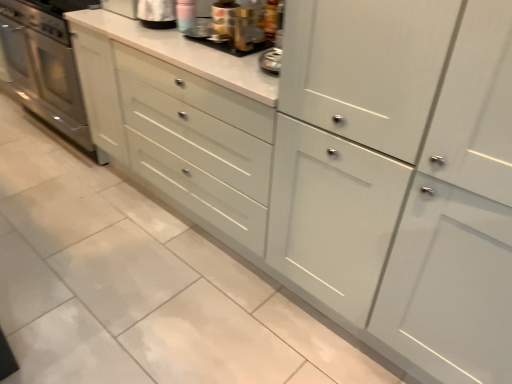
Describe the element at coordinates (244, 29) in the screenshot. The height and width of the screenshot is (384, 512). I see `metallic gold coffee pot at upper center, the 1th appliance when ordered from right to left` at that location.

The width and height of the screenshot is (512, 384). I want to click on metallic silver toaster at upper center, the 2th appliance viewed from the right, so click(231, 45).

Does stainless steel oven at left turn towards metallic gold coffee pot at upper center, the 1th appliance when ordered from right to left?

No, stainless steel oven at left is not facing towards metallic gold coffee pot at upper center, the 1th appliance when ordered from right to left.

Are stainless steel oven at left and metallic gold coffee pot at upper center, the 3th appliance positioned from the left, far apart?

Indeed, stainless steel oven at left is not near metallic gold coffee pot at upper center, the 3th appliance positioned from the left.

Could metallic gold coffee pot at upper center, the 3th appliance positioned from the left, be considered to be inside stainless steel oven at left?

No, metallic gold coffee pot at upper center, the 3th appliance positioned from the left, is located outside of stainless steel oven at left.

From the image's perspective, is stainless steel oven at left under metallic gold coffee pot at upper center, the 1th appliance when ordered from right to left?

Incorrect, from the image's perspective, stainless steel oven at left is higher than metallic gold coffee pot at upper center, the 1th appliance when ordered from right to left.

From the image's perspective, is metallic gold coffee pot at upper center, the 3th appliance positioned from the left, located above metallic silver toaster at upper center, which appears as the 2th appliance when viewed from the left?

No, from the image's perspective, metallic gold coffee pot at upper center, the 3th appliance positioned from the left, is not above metallic silver toaster at upper center, which appears as the 2th appliance when viewed from the left.

Does point (239, 40) appear closer or farther from the camera than point (268, 42)?

Clearly, point (239, 40) is closer to the camera than point (268, 42).

Are metallic gold coffee pot at upper center, the 3th appliance positioned from the left, and metallic silver toaster at upper center, which appears as the 2th appliance when viewed from the left, beside each other?

Indeed, metallic gold coffee pot at upper center, the 3th appliance positioned from the left, and metallic silver toaster at upper center, which appears as the 2th appliance when viewed from the left, are beside each other and touching.

Would you say metallic gold coffee pot at upper center, the 3th appliance positioned from the left, is outside metallic silver toaster at upper center, which appears as the 2th appliance when viewed from the left?

Indeed, metallic gold coffee pot at upper center, the 3th appliance positioned from the left, is completely outside metallic silver toaster at upper center, which appears as the 2th appliance when viewed from the left.

Can you confirm if stainless steel oven at left is smaller than metallic silver toaster at upper center, the 2th appliance viewed from the right?

Incorrect, stainless steel oven at left is not smaller in size than metallic silver toaster at upper center, the 2th appliance viewed from the right.

Visually, is stainless steel oven at left positioned to the left or to the right of metallic silver toaster at upper center, the 2th appliance viewed from the right?

Clearly, stainless steel oven at left is on the left of metallic silver toaster at upper center, the 2th appliance viewed from the right, in the image.

Is stainless steel oven at left far from metallic silver toaster at upper center, the 2th appliance viewed from the right?

Yes.

Is point (36, 46) closer or farther from the camera than point (259, 48)?

Point (36, 46) is farther from the camera than point (259, 48).

Between stainless steel oven at left and metallic silver toaster at upper center, positioned as the 1th appliance in left-to-right order, which one is positioned behind?

stainless steel oven at left is behind.

Would you say stainless steel oven at left is to the left or to the right of metallic silver toaster at upper center, positioned as the 1th appliance in left-to-right order, in the picture?

stainless steel oven at left is positioned on metallic silver toaster at upper center, positioned as the 1th appliance in left-to-right order,'s left side.

Does stainless steel oven at left turn towards metallic silver toaster at upper center, positioned as the 1th appliance in left-to-right order?

No, stainless steel oven at left is not turned towards metallic silver toaster at upper center, positioned as the 1th appliance in left-to-right order.

Which object is positioned more to the right, metallic silver toaster at upper center, the 2th appliance viewed from the right, or stainless steel oven at left?

Positioned to the right is metallic silver toaster at upper center, the 2th appliance viewed from the right.

Can you confirm if metallic silver toaster at upper center, which appears as the 2th appliance when viewed from the left, is wider than stainless steel oven at left?

Incorrect, the width of metallic silver toaster at upper center, which appears as the 2th appliance when viewed from the left, does not surpass that of stainless steel oven at left.

Measure the distance from metallic silver toaster at upper center, which appears as the 2th appliance when viewed from the left, to stainless steel oven at left.

6.18 feet.

Based on the photo, from the image's perspective, is metallic silver toaster at upper center, the 2th appliance viewed from the right, located above stainless steel oven at left?

Incorrect, from the image's perspective, metallic silver toaster at upper center, the 2th appliance viewed from the right, is lower than stainless steel oven at left.

From the image's perspective, is metallic silver toaster at upper center, which appears as the 2th appliance when viewed from the left, above or below metallic gold coffee pot at upper center, the 1th appliance when ordered from right to left?

From the image's perspective, metallic silver toaster at upper center, which appears as the 2th appliance when viewed from the left, appears above metallic gold coffee pot at upper center, the 1th appliance when ordered from right to left.

Considering the sizes of objects metallic silver toaster at upper center, which appears as the 2th appliance when viewed from the left, and metallic gold coffee pot at upper center, the 1th appliance when ordered from right to left, in the image provided, who is wider, metallic silver toaster at upper center, which appears as the 2th appliance when viewed from the left, or metallic gold coffee pot at upper center, the 1th appliance when ordered from right to left,?

metallic silver toaster at upper center, which appears as the 2th appliance when viewed from the left.

Is metallic silver toaster at upper center, which appears as the 2th appliance when viewed from the left, with metallic gold coffee pot at upper center, the 3th appliance positioned from the left?

Yes, metallic silver toaster at upper center, which appears as the 2th appliance when viewed from the left, is beside metallic gold coffee pot at upper center, the 3th appliance positioned from the left.

In the image, is metallic silver toaster at upper center, the 2th appliance viewed from the right, positioned in front of or behind metallic gold coffee pot at upper center, the 3th appliance positioned from the left?

Visually, metallic silver toaster at upper center, the 2th appliance viewed from the right, is located behind metallic gold coffee pot at upper center, the 3th appliance positioned from the left.

Considering the relative positions of metallic gold coffee pot at upper center, the 1th appliance when ordered from right to left, and metallic silver toaster at upper center, which is the third appliance from right to left, in the image provided, is metallic gold coffee pot at upper center, the 1th appliance when ordered from right to left, to the right of metallic silver toaster at upper center, which is the third appliance from right to left, from the viewer's perspective?

Correct, you'll find metallic gold coffee pot at upper center, the 1th appliance when ordered from right to left, to the right of metallic silver toaster at upper center, which is the third appliance from right to left.

Is point (245, 27) in front of point (175, 16)?

Yes, point (245, 27) is closer to viewer.

Does metallic gold coffee pot at upper center, the 3th appliance positioned from the left, contain metallic silver toaster at upper center, positioned as the 1th appliance in left-to-right order?

That's incorrect, metallic silver toaster at upper center, positioned as the 1th appliance in left-to-right order, is not inside metallic gold coffee pot at upper center, the 3th appliance positioned from the left.

I want to click on the 2nd appliance positioned above the metallic gold coffee pot at upper center, the 3th appliance positioned from the left (from the image's perspective), so click(x=157, y=14).

From the image's perspective, count 2nd appliances downward from the stainless steel oven at left and point to it. Please provide its 2D coordinates.

[(244, 29)]

Locate an element on the screen. This screenshot has height=384, width=512. the 1st appliance to the left of the metallic gold coffee pot at upper center, the 3th appliance positioned from the left, starting your count from the anchor is located at coordinates (231, 45).

Looking at the image, which one is located further to metallic gold coffee pot at upper center, the 3th appliance positioned from the left, metallic silver toaster at upper center, positioned as the 1th appliance in left-to-right order, or metallic silver toaster at upper center, the 2th appliance viewed from the right?

metallic silver toaster at upper center, positioned as the 1th appliance in left-to-right order, is further to metallic gold coffee pot at upper center, the 3th appliance positioned from the left.

Which object lies nearer to the anchor point metallic silver toaster at upper center, positioned as the 1th appliance in left-to-right order, stainless steel oven at left or metallic gold coffee pot at upper center, the 1th appliance when ordered from right to left?

metallic gold coffee pot at upper center, the 1th appliance when ordered from right to left.

Which object lies further to the anchor point stainless steel oven at left, metallic silver toaster at upper center, which appears as the 2th appliance when viewed from the left, or metallic silver toaster at upper center, which is the third appliance from right to left?

Among the two, metallic silver toaster at upper center, which appears as the 2th appliance when viewed from the left, is located further to stainless steel oven at left.

Looking at the image, which one is located closer to metallic silver toaster at upper center, the 2th appliance viewed from the right, metallic gold coffee pot at upper center, the 3th appliance positioned from the left, or stainless steel oven at left?

The object closer to metallic silver toaster at upper center, the 2th appliance viewed from the right, is metallic gold coffee pot at upper center, the 3th appliance positioned from the left.

Estimate the real-world distances between objects in this image. Which object is further from stainless steel oven at left, metallic silver toaster at upper center, which appears as the 2th appliance when viewed from the left, or metallic gold coffee pot at upper center, the 3th appliance positioned from the left?

Among the two, metallic gold coffee pot at upper center, the 3th appliance positioned from the left, is located further to stainless steel oven at left.

Based on their spatial positions, is metallic silver toaster at upper center, which appears as the 2th appliance when viewed from the left, or stainless steel oven at left closer to metallic silver toaster at upper center, which is the third appliance from right to left?

Answer: metallic silver toaster at upper center, which appears as the 2th appliance when viewed from the left, is positioned closer to the anchor metallic silver toaster at upper center, which is the third appliance from right to left.

Estimate the real-world distances between objects in this image. Which object is further from metallic silver toaster at upper center, which appears as the 2th appliance when viewed from the left, stainless steel oven at left or metallic gold coffee pot at upper center, the 3th appliance positioned from the left?

Based on the image, stainless steel oven at left appears to be further to metallic silver toaster at upper center, which appears as the 2th appliance when viewed from the left.

Looking at the image, which one is located further to metallic gold coffee pot at upper center, the 3th appliance positioned from the left, metallic silver toaster at upper center, the 2th appliance viewed from the right, or metallic silver toaster at upper center, which is the third appliance from right to left?

metallic silver toaster at upper center, which is the third appliance from right to left.

Locate an element on the screen. The width and height of the screenshot is (512, 384). appliance between metallic silver toaster at upper center, which is the third appliance from right to left, and metallic gold coffee pot at upper center, the 3th appliance positioned from the left is located at coordinates (231, 45).

I want to click on appliance located between stainless steel oven at left and metallic silver toaster at upper center, the 2th appliance viewed from the right, in the left-right direction, so coord(157,14).